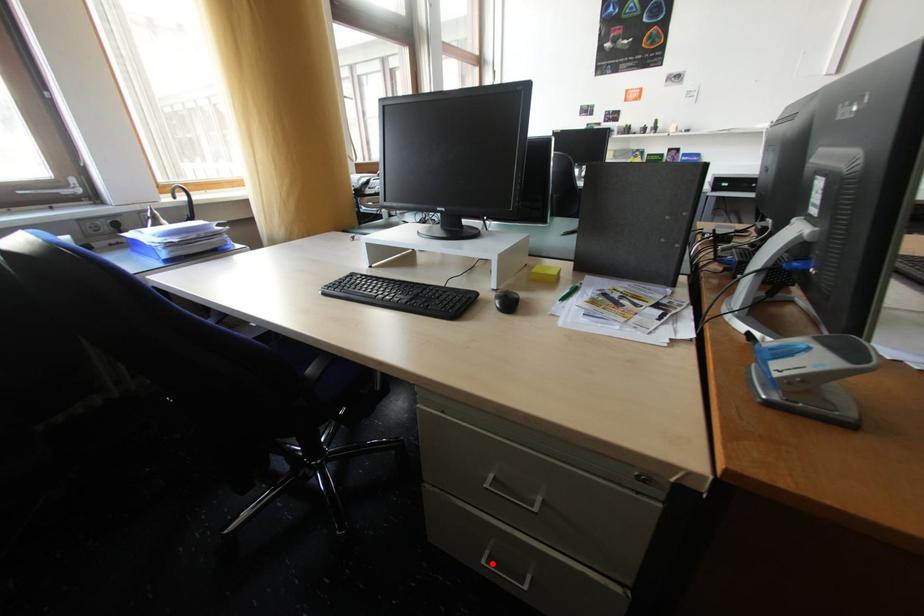
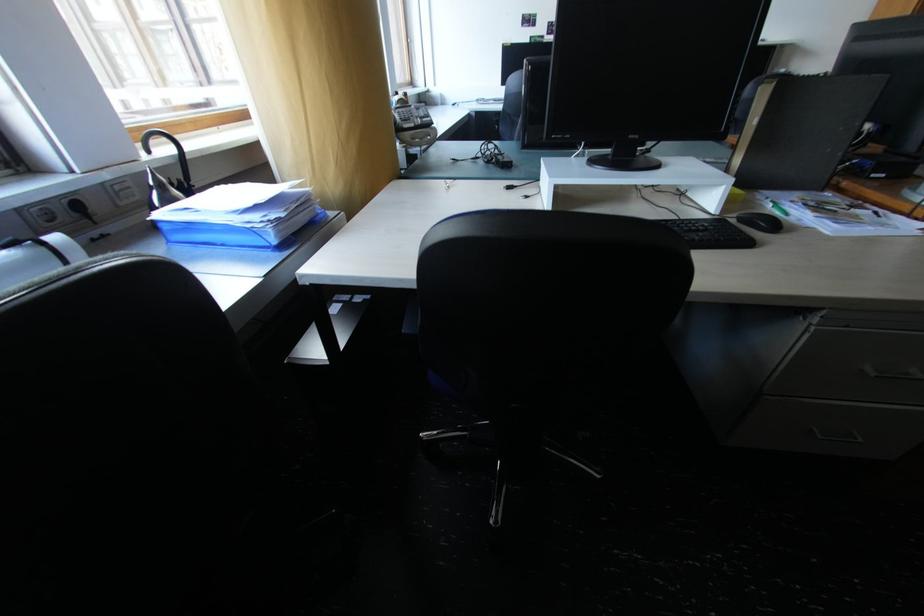
In the second image, find the point that corresponds to the highlighted location in the first image.

(830, 439)